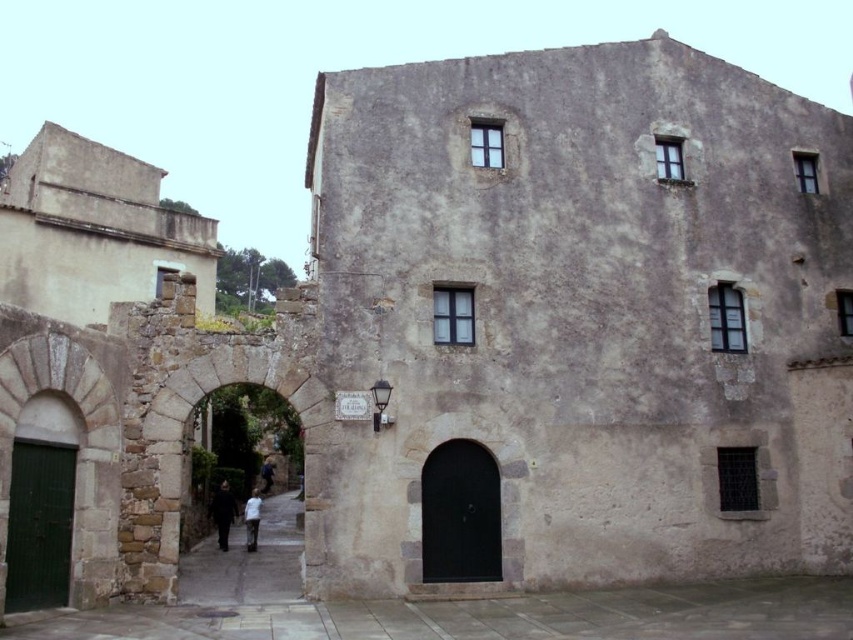
You are a fashion designer observing the historic stone building scene. You notice a black matte coat at center and a white cotton shirt at center. Which clothing item appears smaller in size?

The black matte coat at center has a smaller size compared to the white cotton shirt at center.

You are standing in front of the historic stone building and see a person wearing a white cotton shirt at center and dark blue jeans at center. Which piece of clothing is closer to you?

The white cotton shirt at center is closer to the viewer than the dark blue jeans at center.

You are standing in front of the historic stone building and see a black matte coat at center and dark blue jeans at center. Which item is nearer to you?

The black matte coat at center is closer to the viewer than the dark blue jeans at center.